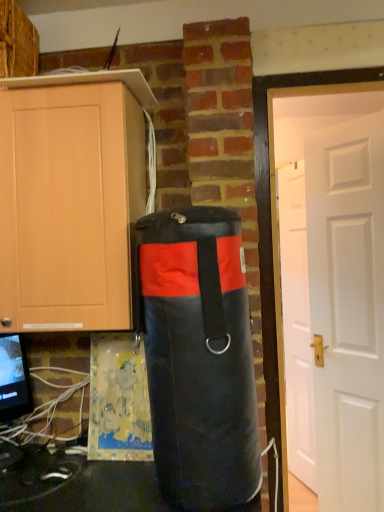
Question: Can you confirm if black fabric punching bag at center is taller than matte wood cabinet at left?

Choices:
 (A) no
 (B) yes

Answer: (B)

Question: Is black fabric punching bag at center thinner than matte wood cabinet at left?

Choices:
 (A) yes
 (B) no

Answer: (A)

Question: Can we say black fabric punching bag at center lies outside matte wood cabinet at left?

Choices:
 (A) no
 (B) yes

Answer: (B)

Question: Can you see black fabric punching bag at center touching matte wood cabinet at left?

Choices:
 (A) yes
 (B) no

Answer: (B)

Question: From the image's perspective, is black fabric punching bag at center under matte wood cabinet at left?

Choices:
 (A) no
 (B) yes

Answer: (B)

Question: Can you confirm if black fabric punching bag at center is bigger than matte wood cabinet at left?

Choices:
 (A) yes
 (B) no

Answer: (B)

Question: Is matte wood cabinet at left facing towards white matte door at right, the second door viewed from the back?

Choices:
 (A) no
 (B) yes

Answer: (A)

Question: Is matte wood cabinet at left directly adjacent to white matte door at right, the second door viewed from the back?

Choices:
 (A) yes
 (B) no

Answer: (B)

Question: Considering the relative positions of matte wood cabinet at left and white matte door at right, the 1th door when ordered from front to back, in the image provided, is matte wood cabinet at left to the right of white matte door at right, the 1th door when ordered from front to back, from the viewer's perspective?

Choices:
 (A) yes
 (B) no

Answer: (B)

Question: From a real-world perspective, is matte wood cabinet at left on white matte door at right, the second door viewed from the back?

Choices:
 (A) no
 (B) yes

Answer: (B)

Question: Is matte wood cabinet at left far from white matte door at right, the second door viewed from the back?

Choices:
 (A) no
 (B) yes

Answer: (B)

Question: Is matte wood cabinet at left positioned behind white matte door at right, the second door viewed from the back?

Choices:
 (A) no
 (B) yes

Answer: (A)

Question: Is black fabric punching bag at center to the right of white matte door at right, the first door when ordered from back to front, from the viewer's perspective?

Choices:
 (A) no
 (B) yes

Answer: (A)